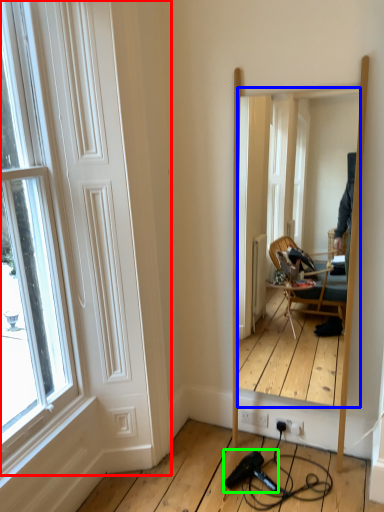
Question: Estimate the real-world distances between objects in this image. Which object is closer to door (highlighted by a red box), mirror (highlighted by a blue box) or hair drier (highlighted by a green box)?

Choices:
 (A) mirror
 (B) hair drier

Answer: (B)